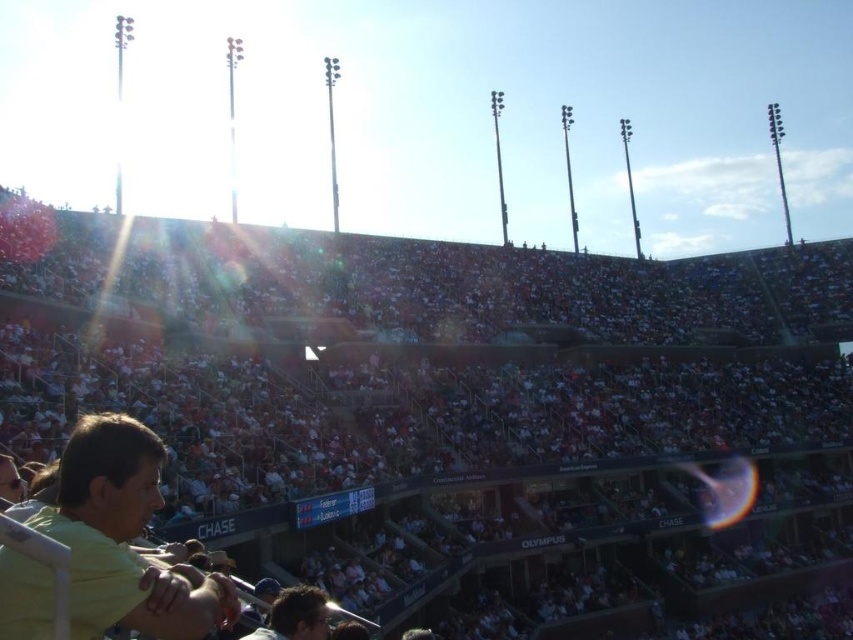
Question: Where is yellow matte shirt at lower left located in relation to dark brown hair at lower center in the image?

Choices:
 (A) right
 (B) left

Answer: (B)

Question: Which point appears closest to the camera in this image?

Choices:
 (A) (300, 592)
 (B) (74, 628)
 (C) (257, 243)

Answer: (B)

Question: Is yellow matte shirt at lower left closer to the viewer compared to dark brown hair at lower center?

Choices:
 (A) no
 (B) yes

Answer: (B)

Question: Which point appears closest to the camera in this image?

Choices:
 (A) (120, 580)
 (B) (305, 620)

Answer: (A)

Question: Is white fabric crowd at center behind dark brown hair at lower center?

Choices:
 (A) no
 (B) yes

Answer: (B)

Question: Which point is farther from the camera taking this photo?

Choices:
 (A) (73, 637)
 (B) (296, 604)

Answer: (B)